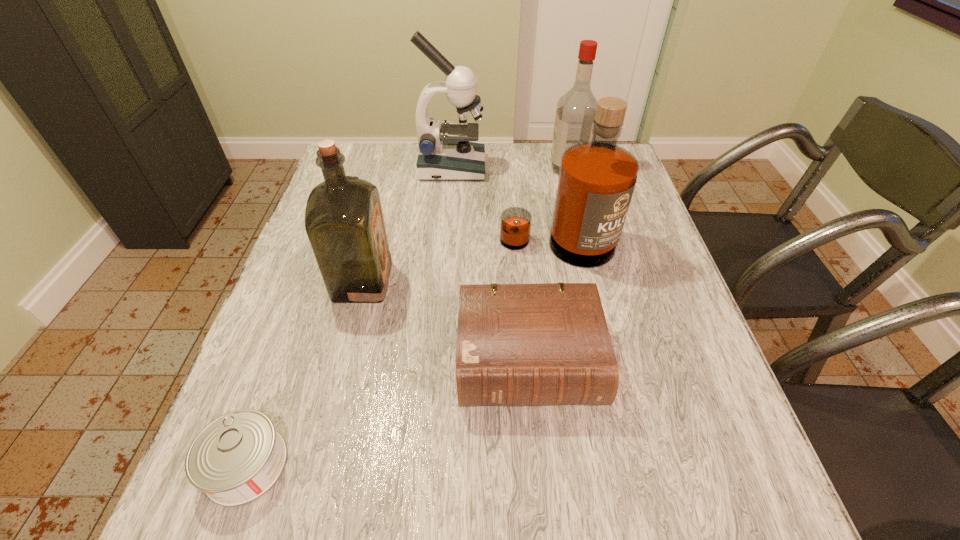
This screenshot has width=960, height=540. Find the location of `free space located on the front-facing side of the farthest liquor`. free space located on the front-facing side of the farthest liquor is located at coordinates (532, 168).

Locate an element on the screen. Image resolution: width=960 pixels, height=540 pixels. vacant area located 0.280m on the label of the leftmost liquor is located at coordinates (510, 281).

Identify the location of free space located on the spine side of the fifth farthest object. The height and width of the screenshot is (540, 960). (539, 472).

Locate an element on the screen. Image resolution: width=960 pixels, height=540 pixels. vacant region located on the right of the can is located at coordinates click(x=423, y=464).

The width and height of the screenshot is (960, 540). Find the location of `microscope that is at the far edge`. microscope that is at the far edge is located at coordinates (445, 153).

This screenshot has height=540, width=960. I want to click on liquor located at the far edge, so click(576, 109).

Find the location of a particular element. This screenshot has width=960, height=540. object located at the near edge is located at coordinates (235, 459).

This screenshot has height=540, width=960. I want to click on liquor that is at the left edge, so click(344, 222).

Where is `can that is at the left edge`? This screenshot has height=540, width=960. can that is at the left edge is located at coordinates (235, 459).

Identify the location of object that is at the near left corner. (235, 459).